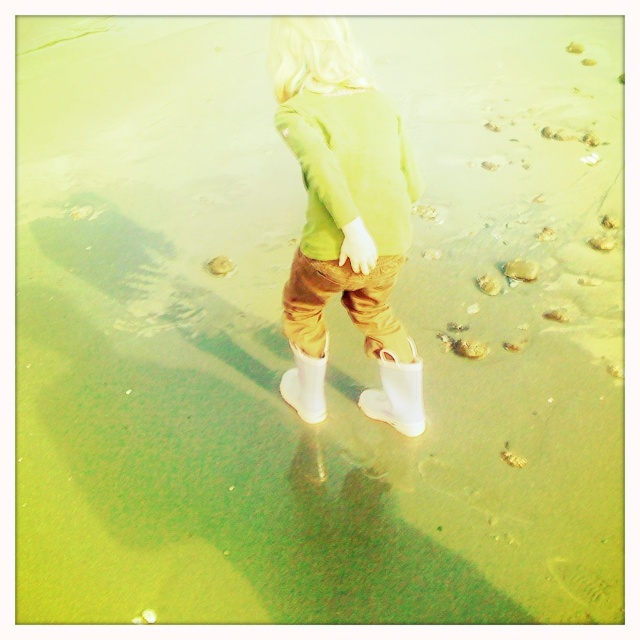
Consider the image. The child is wearing a green matte sweatshirt at center and a white rubber boot at lower center. Which item of clothing is bigger?

The green matte sweatshirt at center is larger in size than the white rubber boot at lower center.

You are a photographer trying to capture the exact location of the white rubber boot at lower center in the image. According to the coordinates provided, where would you focus your camera to ensure the boot is centered in the frame?

The white rubber boot at lower center is positioned at coordinates point (396, 394), so you should focus your camera at that exact point to center it in the frame.

You are a drone operator trying to locate the white rubber boot at center in the image. The image has a coordinate system where the bottom left corner is the origin. Can you confirm if the white rubber boot at center is located at point (305, 385)?

The point (305, 385) corresponds to the white rubber boot at center, so yes, the white rubber boot at center is located at that coordinate.